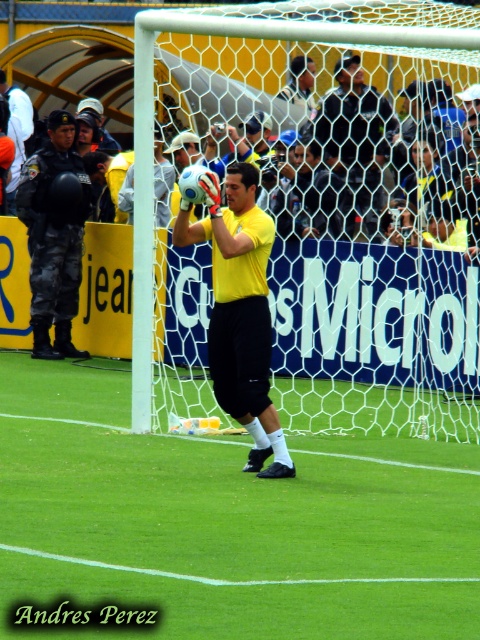
You are a soccer player trying to score a goal. You see the point at coordinates (55, 234). What object is located there?

The point at coordinates (55, 234) corresponds to the matte black helmet at left.

You are a photographer standing in the stadium, and you want to take a photo of the matte black helmet at left and the yellow matte shirt at center. Which object should you adjust your camera to focus on first if you want to capture both in the frame?

The matte black helmet at left is to the left of yellow matte shirt at center, so you should focus on the matte black helmet at left first to ensure both are in the frame.

You are a photographer at the soccer match. You want to capture a photo where the white mesh net at center and the matte black helmet at left are both clearly visible. Based on their positions, which object should you focus on to ensure both are in frame?

The white mesh net at center is above the matte black helmet at left, so focusing on the white mesh net at center will ensure both objects are within the frame as the helmet is positioned below it.